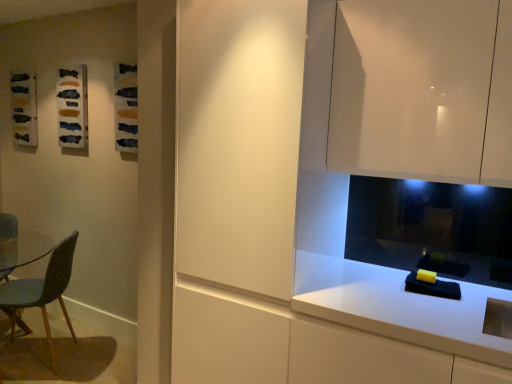
Question: Is blue fabric chair at left closer to camera compared to white glossy countertop at lower right?

Choices:
 (A) yes
 (B) no

Answer: (B)

Question: Considering the relative sizes of blue fabric chair at left and white glossy countertop at lower right in the image provided, is blue fabric chair at left thinner than white glossy countertop at lower right?

Choices:
 (A) no
 (B) yes

Answer: (B)

Question: From the image's perspective, is blue fabric chair at left below white glossy countertop at lower right?

Choices:
 (A) no
 (B) yes

Answer: (A)

Question: Is blue fabric chair at left positioned behind white glossy countertop at lower right?

Choices:
 (A) no
 (B) yes

Answer: (B)

Question: Does blue fabric chair at left appear on the right side of white glossy countertop at lower right?

Choices:
 (A) yes
 (B) no

Answer: (B)

Question: Visually, is matte textured fabric at upper left positioned to the left or to the right of white glossy countertop at lower right?

Choices:
 (A) right
 (B) left

Answer: (B)

Question: Is matte textured fabric at upper left inside or outside of white glossy countertop at lower right?

Choices:
 (A) inside
 (B) outside

Answer: (B)

Question: From the image's perspective, is matte textured fabric at upper left above or below white glossy countertop at lower right?

Choices:
 (A) above
 (B) below

Answer: (A)

Question: In terms of size, does matte textured fabric at upper left appear bigger or smaller than white glossy countertop at lower right?

Choices:
 (A) big
 (B) small

Answer: (B)

Question: Is white glossy countertop at lower right in front of or behind matte white cabinet at center in the image?

Choices:
 (A) front
 (B) behind

Answer: (A)

Question: Based on their sizes in the image, would you say white glossy countertop at lower right is bigger or smaller than matte white cabinet at center?

Choices:
 (A) small
 (B) big

Answer: (A)

Question: Is white glossy countertop at lower right situated inside matte white cabinet at center or outside?

Choices:
 (A) inside
 (B) outside

Answer: (B)

Question: Considering the positions of white glossy countertop at lower right and matte white cabinet at center in the image, is white glossy countertop at lower right wider or thinner than matte white cabinet at center?

Choices:
 (A) thin
 (B) wide

Answer: (B)

Question: From a real-world perspective, is white glossy countertop at lower right positioned above or below glossy white cabinet at upper right?

Choices:
 (A) below
 (B) above

Answer: (A)

Question: Is white glossy countertop at lower right bigger or smaller than glossy white cabinet at upper right?

Choices:
 (A) big
 (B) small

Answer: (A)